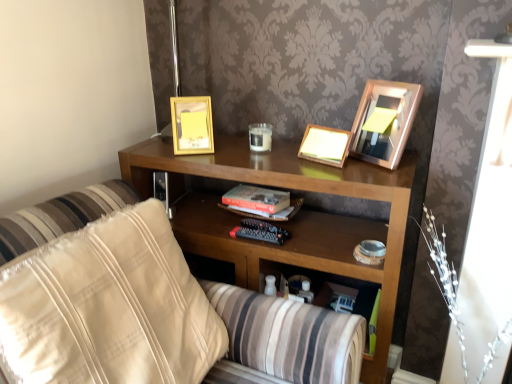
Identify the location of vacant area in front of wooden picture frame at center, which is counted as the 2th picture frame, starting from the left. (346, 177).